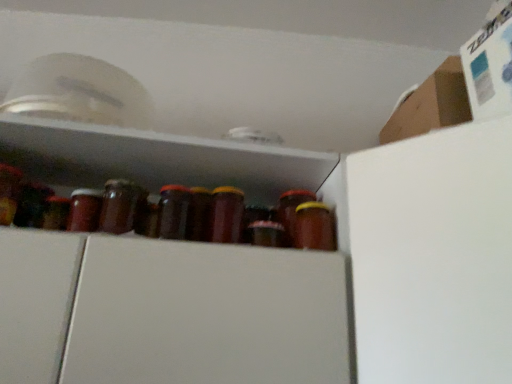
Find the location of a particular element. translucent glass jar at center is located at coordinates (314, 227).

Describe the element at coordinates (314, 227) in the screenshot. I see `translucent glass jar at center` at that location.

This screenshot has height=384, width=512. What are the coordinates of `translucent glass jar at center` in the screenshot? It's located at (314, 227).